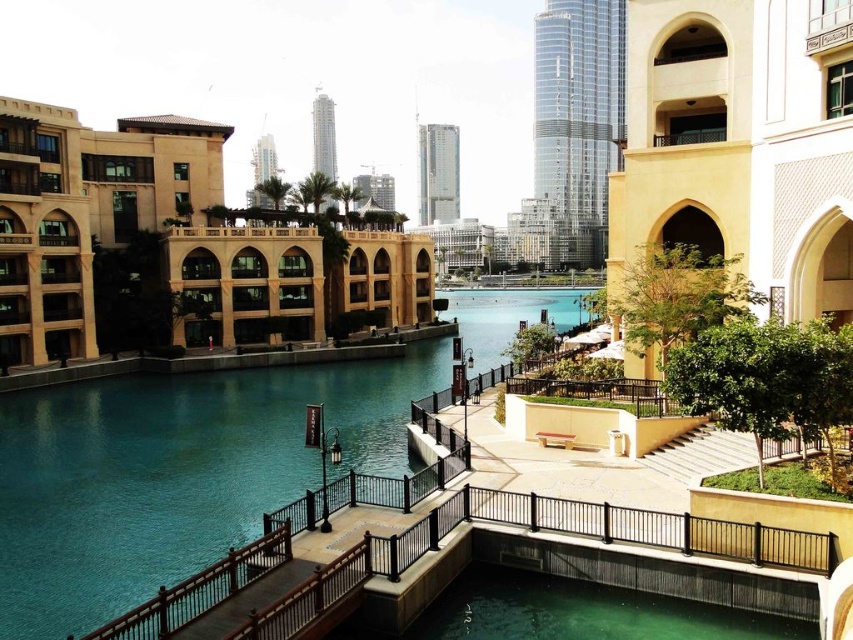
You are standing at the starting point of the walkway in the waterfront scene. You want to reach the teal glossy water at center. What direction should you move in to get there?

The teal glossy water at center is located at coordinates point (173, 474), so you should move towards the lower right direction from your starting position on the walkway.

You are a tourist standing on the walkway near the teal glossy water at center and want to take a photo of the beige stone building at left. Since the water is in front of the building, will you need to move closer to the building to get it fully in frame without the water obstructing it?

The teal glossy water at center is in front of the beige stone building at left, so you need to move closer to the beige stone building at left to ensure it is fully visible in your photo without the water blocking the view.

You are a maintenance worker inspecting the waterfront area. You notice the teal glossy water at center and the black metal railing at lower center. Which object is located higher in the scene?

The teal glossy water at center is positioned over the black metal railing at lower center, so it is higher in the scene.